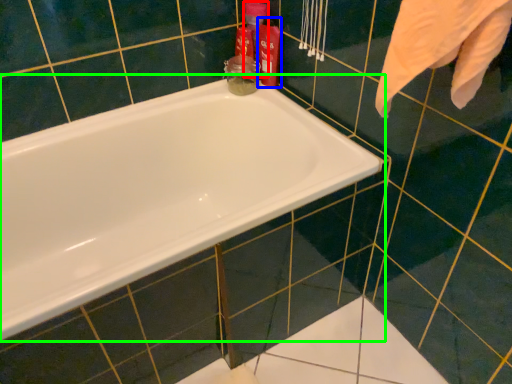
Question: Which is nearer to the cleaning product (highlighted by a red box)? cleaning product (highlighted by a blue box) or bathtub (highlighted by a green box).

Choices:
 (A) cleaning product
 (B) bathtub

Answer: (A)